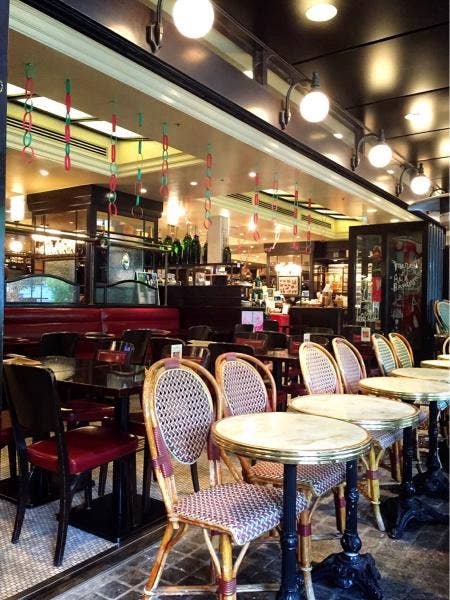
The height and width of the screenshot is (600, 450). Find the location of `decorative interlocking loops on ceiling`. decorative interlocking loops on ceiling is located at coordinates (26, 110), (68, 119), (113, 145), (137, 156), (163, 165), (208, 184), (274, 206), (295, 227), (309, 233).